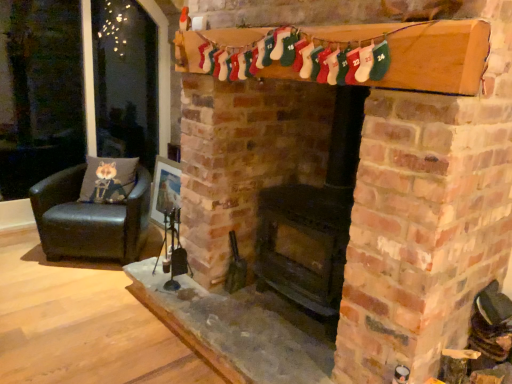
Question: Does black leather chair at left appear on the left side of black matte fireplace at center?

Choices:
 (A) yes
 (B) no

Answer: (A)

Question: From the image's perspective, is black leather chair at left under black matte fireplace at center?

Choices:
 (A) yes
 (B) no

Answer: (A)

Question: Is black leather chair at left oriented away from black matte fireplace at center?

Choices:
 (A) yes
 (B) no

Answer: (B)

Question: Considering the relative sizes of black leather chair at left and black matte fireplace at center in the image provided, is black leather chair at left wider than black matte fireplace at center?

Choices:
 (A) yes
 (B) no

Answer: (A)

Question: Considering the relative sizes of black leather chair at left and black matte fireplace at center in the image provided, is black leather chair at left bigger than black matte fireplace at center?

Choices:
 (A) no
 (B) yes

Answer: (A)

Question: Could you tell me if black leather chair at left is facing black matte fireplace at center?

Choices:
 (A) yes
 (B) no

Answer: (B)

Question: Is black leather chair at left located within black matte fireplace at center?

Choices:
 (A) no
 (B) yes

Answer: (A)

Question: Considering the relative sizes of black matte fireplace at center and black leather chair at left in the image provided, is black matte fireplace at center shorter than black leather chair at left?

Choices:
 (A) no
 (B) yes

Answer: (A)

Question: From the image's perspective, would you say black matte fireplace at center is positioned over black leather chair at left?

Choices:
 (A) yes
 (B) no

Answer: (A)

Question: Is black matte fireplace at center at the left side of black leather chair at left?

Choices:
 (A) yes
 (B) no

Answer: (B)

Question: From a real-world perspective, is black matte fireplace at center located higher than black leather chair at left?

Choices:
 (A) no
 (B) yes

Answer: (B)

Question: Is black matte fireplace at center with black leather chair at left?

Choices:
 (A) no
 (B) yes

Answer: (A)

Question: Would you say black matte fireplace at center contains gray fabric cushion at left?

Choices:
 (A) yes
 (B) no

Answer: (B)